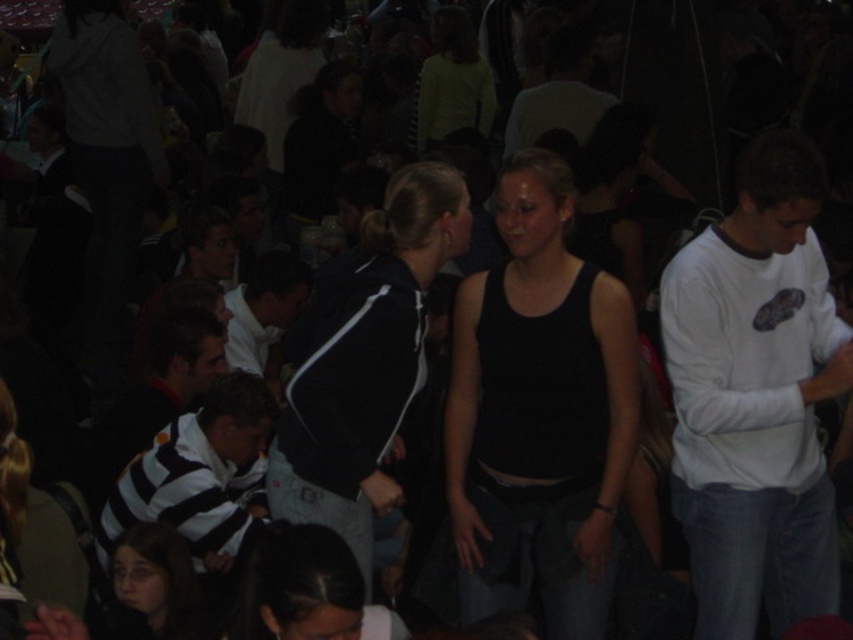
Who is positioned more to the right, white long-sleeved shirt at right or striped jersey at center?

white long-sleeved shirt at right

Based on the photo, can you confirm if white long-sleeved shirt at right is bigger than striped jersey at center?

Yes.

Does point (724, 285) come closer to viewer compared to point (102, 481)?

Yes, it is.

Locate an element on the screen. The image size is (853, 640). white long-sleeved shirt at right is located at coordinates (756, 396).

Is striped jersey at center thinner than dark brown hair at lower left?

In fact, striped jersey at center might be wider than dark brown hair at lower left.

Where is `striped jersey at center`? This screenshot has height=640, width=853. striped jersey at center is located at coordinates (160, 388).

Is point (219, 332) more distant than point (172, 548)?

Yes, point (219, 332) is behind point (172, 548).

Identify the location of striped jersey at center. The height and width of the screenshot is (640, 853). (160, 388).

Is point (225, 442) behind point (260, 364)?

That is False.

Is striped jersey shirt at lower left further to camera compared to white striped shirt at center?

That is False.

Which is in front, point (231, 476) or point (271, 308)?

Positioned in front is point (231, 476).

Where is `striped jersey shirt at lower left`? striped jersey shirt at lower left is located at coordinates (196, 474).